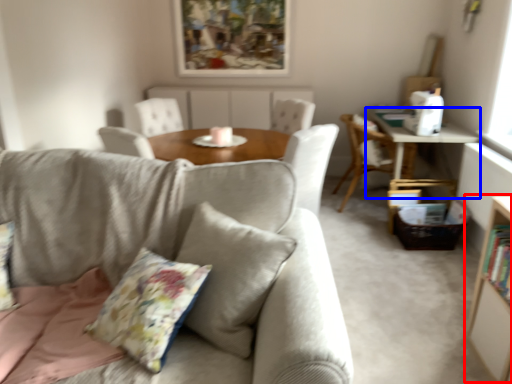
Question: Among these objects, which one is farthest to the camera, bookcase (highlighted by a red box) or table (highlighted by a blue box)?

Choices:
 (A) bookcase
 (B) table

Answer: (B)